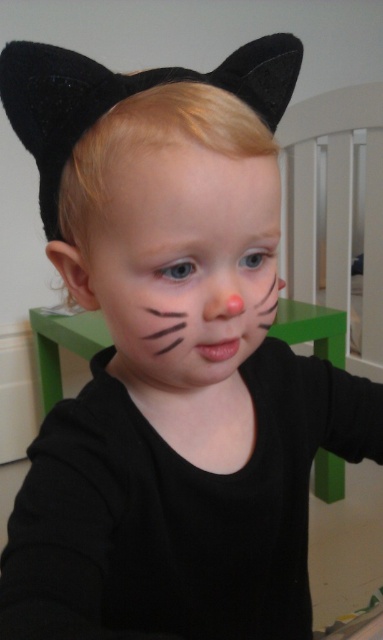
Question: Is matte black face at center positioned at the back of pink matte nose at center?

Choices:
 (A) yes
 (B) no

Answer: (B)

Question: Among these objects, which one is nearest to the camera?

Choices:
 (A) smooth skin at center
 (B) matte black face at center

Answer: (B)

Question: Estimate the real-world distances between objects in this image. Which object is closer to the smooth skin at center?

Choices:
 (A) matte black face at center
 (B) pink matte nose at center

Answer: (A)

Question: Is matte black face at center to the right of smooth skin at center from the viewer's perspective?

Choices:
 (A) yes
 (B) no

Answer: (B)

Question: Among these objects, which one is farthest from the camera?

Choices:
 (A) smooth skin at center
 (B) matte black face at center

Answer: (A)

Question: Can you confirm if matte black face at center is positioned to the left of pink matte nose at center?

Choices:
 (A) yes
 (B) no

Answer: (A)